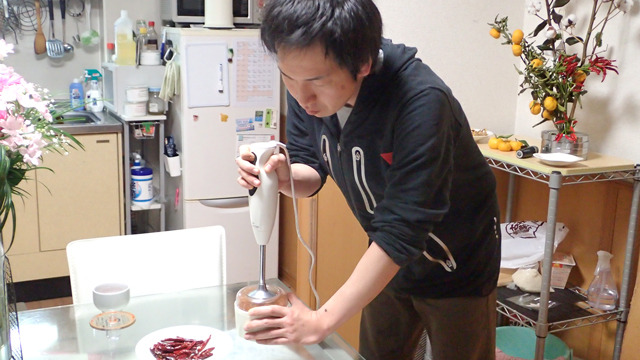
Image resolution: width=640 pixels, height=360 pixels. Identify the location of wall. (438, 27).